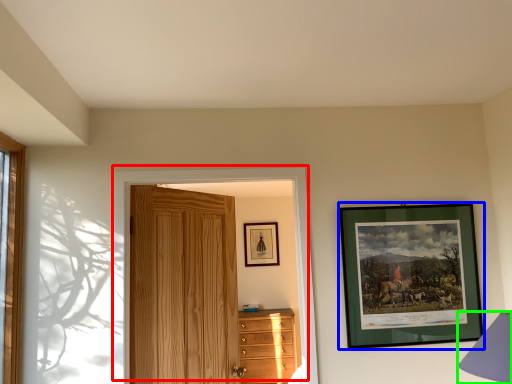
Question: Estimate the real-world distances between objects in this image. Which object is closer to door (highlighted by a red box), picture frame (highlighted by a blue box) or table lamp (highlighted by a green box)?

Choices:
 (A) picture frame
 (B) table lamp

Answer: (A)